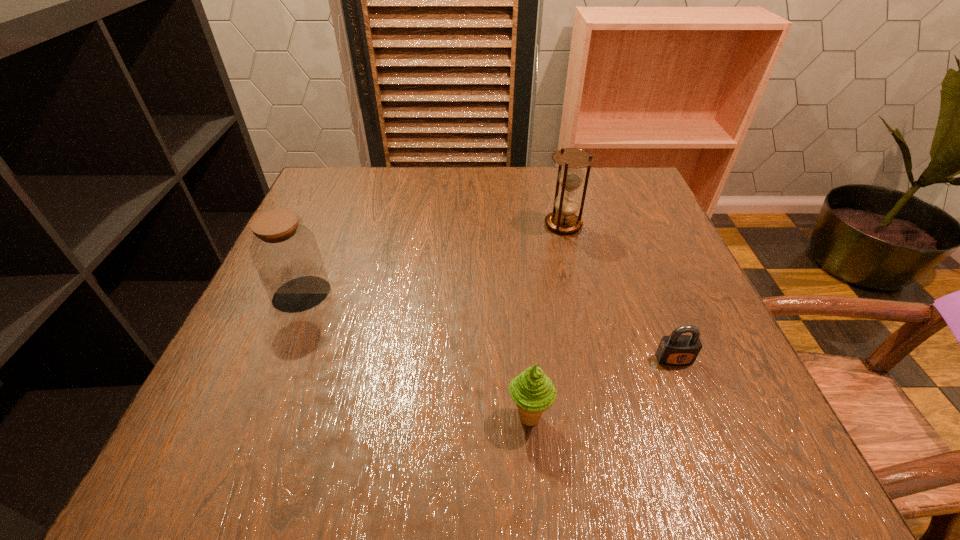
This screenshot has height=540, width=960. In order to click on vacant point located between the nearest object and the leftmost object in this screenshot , I will do 416,356.

Where is `vacant point located between the jar and the icecream`? This screenshot has height=540, width=960. vacant point located between the jar and the icecream is located at coordinates pyautogui.click(x=416, y=356).

Locate an element on the screen. vacant space that's between the shortest object and the nearest object is located at coordinates (602, 388).

This screenshot has width=960, height=540. I want to click on object that stands as the second closest to the rightmost object, so click(563, 219).

In order to click on the second closest object to the farthest object in this screenshot , I will do pyautogui.click(x=533, y=392).

Locate an element on the screen. vacant region that satisfies the following two spatial constraints: 1. on the front side of the second shortest object; 2. on the right side of the jar is located at coordinates (252, 417).